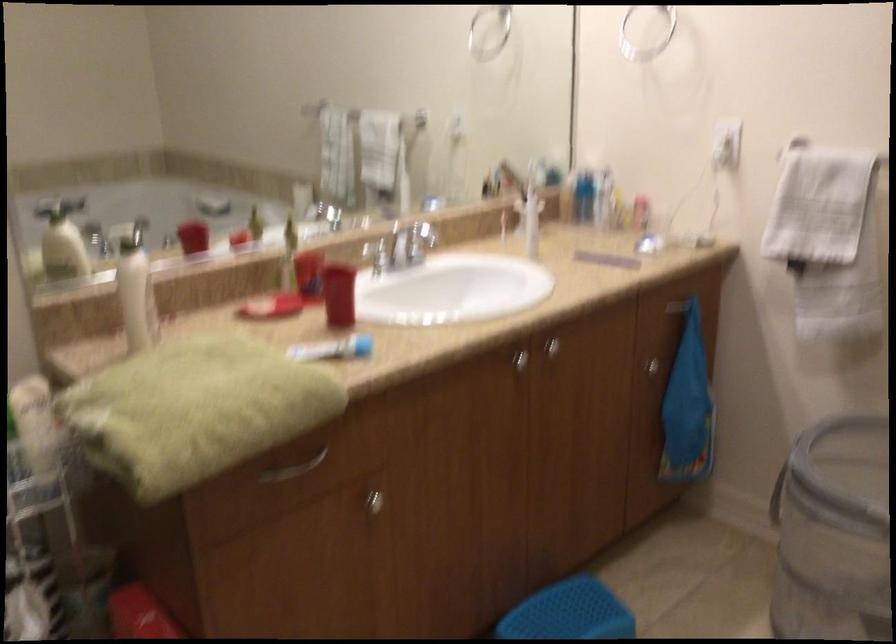
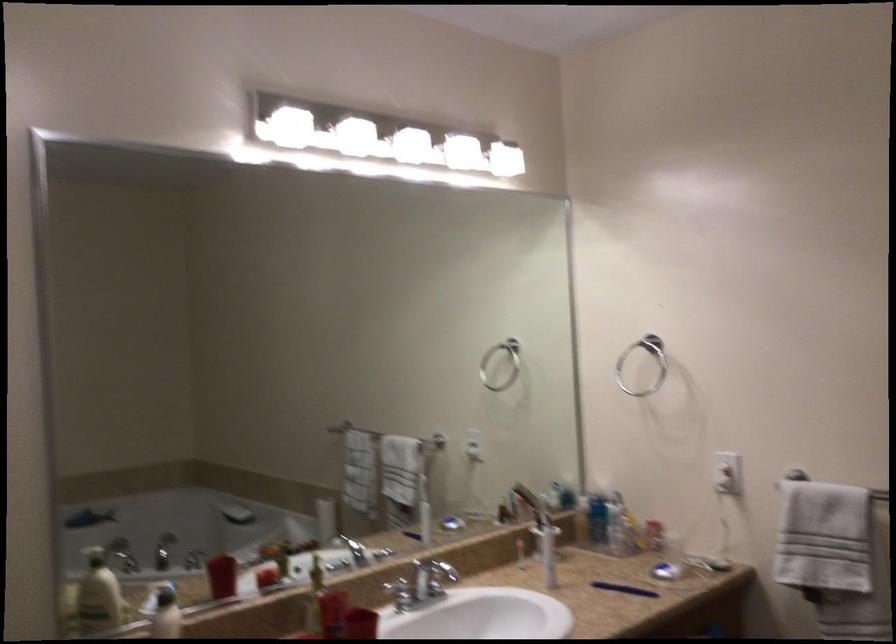
Question: The images are taken continuously from a first-person perspective. In which direction is your viewpoint rotating?

Choices:
 (A) Left
 (B) Right
 (C) Up
 (D) Down

Answer: (C)